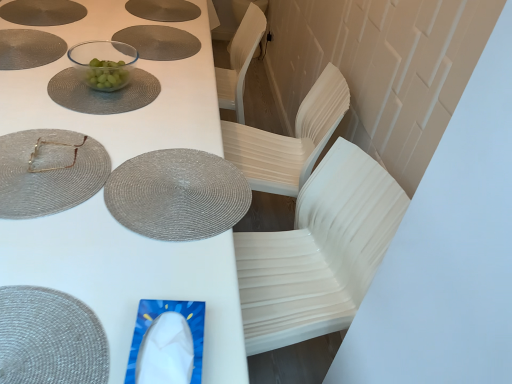
Where is `free area in between matte gray placemat at upper left, the first plate from the left, and transparent glass bowl at upper center, which is the second glass plate from front to back`? The height and width of the screenshot is (384, 512). free area in between matte gray placemat at upper left, the first plate from the left, and transparent glass bowl at upper center, which is the second glass plate from front to back is located at coordinates (62, 64).